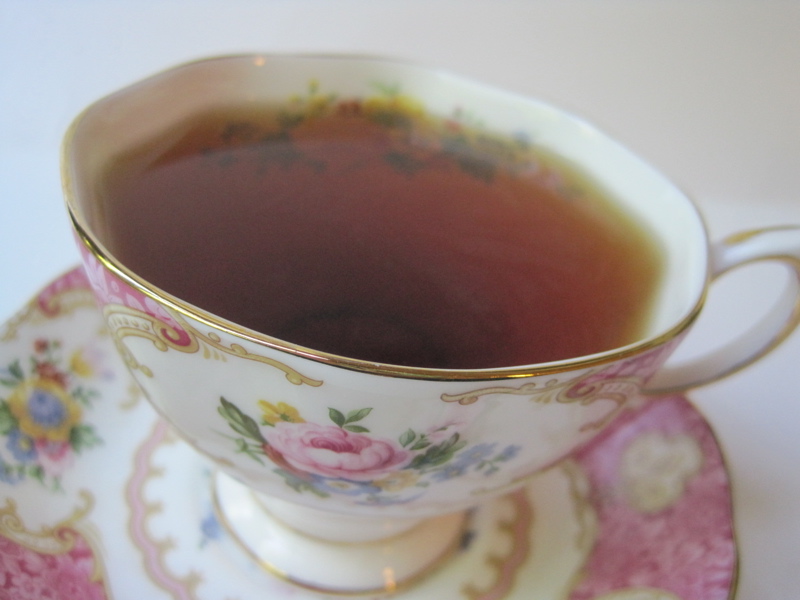
What are the coordinates of `light reflections` in the screenshot? It's located at (388, 581), (522, 371), (226, 330), (256, 59).